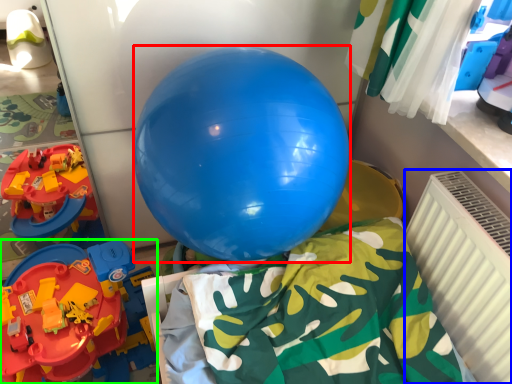
Question: Which object is positioned closest to balloon (highlighted by a red box)? Select from radiator (highlighted by a blue box) and toy (highlighted by a green box).

Choices:
 (A) radiator
 (B) toy

Answer: (A)